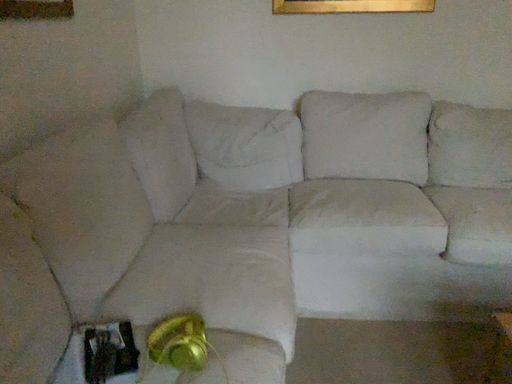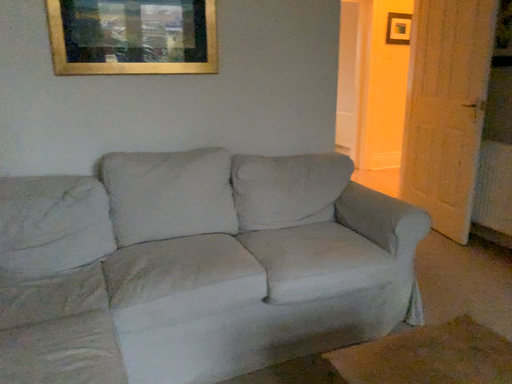
Question: Which way did the camera rotate in the video?

Choices:
 (A) rotated upward
 (B) rotated downward

Answer: (A)